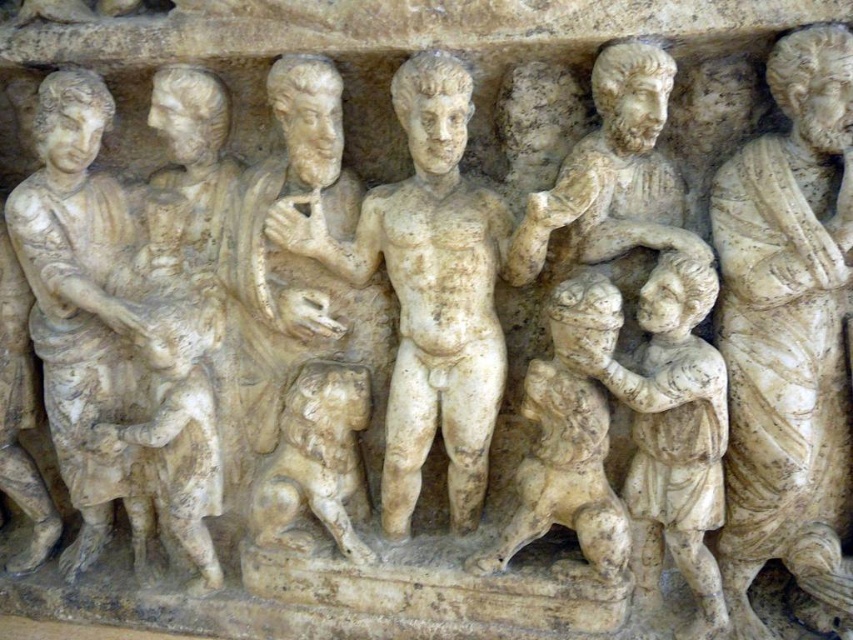
Is point (303, 243) more distant than point (288, 531)?

No, (303, 243) is in front of (288, 531).

Does white marble statue at center have a greater width compared to white stone lion at lower left?

Yes.

I want to click on white marble statue at center, so click(x=432, y=289).

Between white marble figure at right and white marble child at center, which one has more height?

white marble figure at right

Who is more forward, (x=846, y=456) or (x=532, y=508)?

Point (x=846, y=456) is more forward.

This screenshot has height=640, width=853. In order to click on white marble figure at right in this screenshot , I will do `click(788, 330)`.

Does white marble child at center appear on the left side of white stone lion at lower left?

In fact, white marble child at center is to the right of white stone lion at lower left.

Between white marble child at center and white stone lion at lower left, which one is positioned lower?

white stone lion at lower left is lower down.

Which is in front, point (552, 500) or point (328, 528)?

Positioned in front is point (552, 500).

Locate an element on the screen. The image size is (853, 640). white marble child at center is located at coordinates (569, 436).